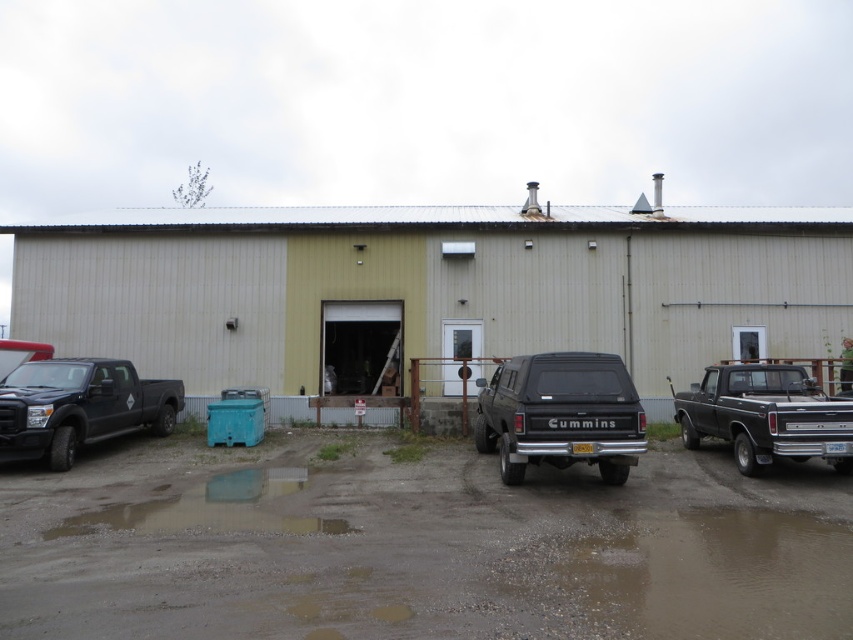
Question: Which object appears farthest from the camera in this image?

Choices:
 (A) black matte truck at right
 (B) brown textured mud at lower center
 (C) black matte truck at center

Answer: (A)

Question: Is matte black truck at left bigger than black matte truck at right?

Choices:
 (A) no
 (B) yes

Answer: (A)

Question: Estimate the real-world distances between objects in this image. Which object is closer to the brown textured mud at lower center?

Choices:
 (A) matte black truck at left
 (B) black matte truck at center
 (C) black matte truck at right

Answer: (B)

Question: Can you confirm if black matte truck at center is positioned to the left of matte black truck at left?

Choices:
 (A) yes
 (B) no

Answer: (B)

Question: Which point is farther to the camera?

Choices:
 (A) brown textured mud at lower center
 (B) black matte truck at center
 (C) black matte truck at right

Answer: (C)

Question: Is matte black truck at left above black matte truck at right?

Choices:
 (A) no
 (B) yes

Answer: (A)